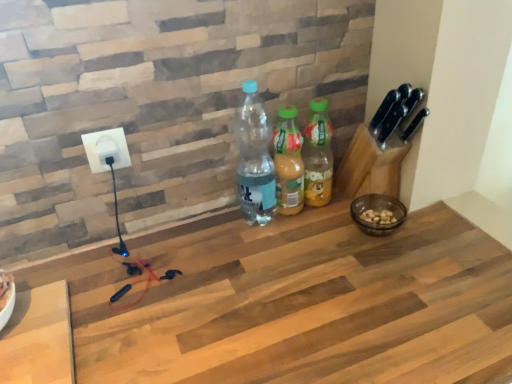
This screenshot has width=512, height=384. Describe the element at coordinates (297, 303) in the screenshot. I see `wooden at center` at that location.

In order to click on transparent plastic bottle at center, which is the first bottle in left-to-right order in this screenshot , I will do `click(254, 158)`.

Choose the correct answer: Is translucent plastic bottle at center, which is counted as the second bottle, starting from the right, inside white plastic socket at upper left or outside it?

The correct answer is: outside.

Is translucent plastic bottle at center, the 2th bottle from the left, directly adjacent to white plastic socket at upper left?

No, translucent plastic bottle at center, the 2th bottle from the left, is not making contact with white plastic socket at upper left.

Based on their sizes in the image, would you say translucent plastic bottle at center, which is counted as the second bottle, starting from the right, is bigger or smaller than white plastic socket at upper left?

In the image, translucent plastic bottle at center, which is counted as the second bottle, starting from the right, appears to be larger than white plastic socket at upper left.

From a real-world perspective, which object stands above the other?

In real-world perspective, white plastic socket at upper left is above.

Can you confirm if transparent plastic bottle at center, which is the first bottle in left-to-right order, is smaller than wooden at center?

Indeed, transparent plastic bottle at center, which is the first bottle in left-to-right order, has a smaller size compared to wooden at center.

Consider the image. Is transparent plastic bottle at center, the third bottle from the right, oriented towards wooden at center?

No, transparent plastic bottle at center, the third bottle from the right, is not turned towards wooden at center.

Is transparent plastic bottle at center, which is the first bottle in left-to-right order, to the right of wooden at center from the viewer's perspective?

In fact, transparent plastic bottle at center, which is the first bottle in left-to-right order, is to the left of wooden at center.

What's the angular difference between translucent plastic bottle at center, arranged as the first bottle when viewed from the right, and transparent plastic bottle at center, the third bottle from the right,'s facing directions?

0.00177 degrees separate the facing orientations of translucent plastic bottle at center, arranged as the first bottle when viewed from the right, and transparent plastic bottle at center, the third bottle from the right.

What are the coordinates of `bottle that is the 2nd object to the left of the translucent plastic bottle at center, which is the third bottle from left to right, starting at the anchor` in the screenshot? It's located at pos(254,158).

Between translucent plastic bottle at center, arranged as the first bottle when viewed from the right, and transparent plastic bottle at center, the third bottle from the right, which one has smaller size?

Smaller between the two is translucent plastic bottle at center, arranged as the first bottle when viewed from the right.

Is translucent plastic bottle at center, which is the third bottle from left to right, facing away from transparent plastic bottle at center, the third bottle from the right?

No, translucent plastic bottle at center, which is the third bottle from left to right, is not facing the opposite direction of transparent plastic bottle at center, the third bottle from the right.

Which of these two, white plastic socket at upper left or translucent plastic bottle at center, arranged as the first bottle when viewed from the right, is thinner?

white plastic socket at upper left is thinner.

Locate an element on the screen. Image resolution: width=512 pixels, height=384 pixels. the 3rd bottle to the right when counting from the white plastic socket at upper left is located at coordinates (318, 155).

Which is more to the right, white plastic socket at upper left or translucent plastic bottle at center, arranged as the first bottle when viewed from the right?

translucent plastic bottle at center, arranged as the first bottle when viewed from the right, is more to the right.

From the image's perspective, is white plastic socket at upper left positioned above or below translucent plastic bottle at center, which is the third bottle from left to right?

From the image's perspective, white plastic socket at upper left appears below translucent plastic bottle at center, which is the third bottle from left to right.

Who is bigger, translucent plastic bottle at center, arranged as the first bottle when viewed from the right, or wooden at center?

With larger size is wooden at center.

Looking at this image, which object is thinner, translucent plastic bottle at center, which is the third bottle from left to right, or wooden at center?

translucent plastic bottle at center, which is the third bottle from left to right.

Consider the image. From a real-world perspective, is translucent plastic bottle at center, which is the third bottle from left to right, physically located above or below wooden at center?

translucent plastic bottle at center, which is the third bottle from left to right, is situated higher than wooden at center in the real world.

Would you consider translucent plastic bottle at center, which is the third bottle from left to right, to be distant from wooden at center?

Actually, translucent plastic bottle at center, which is the third bottle from left to right, and wooden at center are a little close together.

Is wooden at center turned away from white plastic socket at upper left?

No, wooden at center's orientation is not away from white plastic socket at upper left.

Is wooden at center positioned beyond the bounds of white plastic socket at upper left?

wooden at center lies outside white plastic socket at upper left's area.

Which object is closer to the camera taking this photo, wooden at center or white plastic socket at upper left?

wooden at center.

From a real-world perspective, is wooden at center under white plastic socket at upper left?

Yes, from a real-world perspective, wooden at center is beneath white plastic socket at upper left.

Would you consider translucent plastic bottle at center, which is counted as the second bottle, starting from the right, to be distant from translucent plastic bottle at center, which is the third bottle from left to right?

They are positioned close to each other.

Considering the relative sizes of translucent plastic bottle at center, the 2th bottle from the left, and translucent plastic bottle at center, arranged as the first bottle when viewed from the right, in the image provided, is translucent plastic bottle at center, the 2th bottle from the left, shorter than translucent plastic bottle at center, arranged as the first bottle when viewed from the right,?

Yes, translucent plastic bottle at center, the 2th bottle from the left, is shorter than translucent plastic bottle at center, arranged as the first bottle when viewed from the right.

From a real-world perspective, which object stands above the other?

translucent plastic bottle at center, arranged as the first bottle when viewed from the right, is physically above.

Which is more to the right, translucent plastic bottle at center, which is counted as the second bottle, starting from the right, or translucent plastic bottle at center, which is the third bottle from left to right?

translucent plastic bottle at center, which is the third bottle from left to right, is more to the right.

Find the location of a particular element. This screenshot has height=384, width=512. power plugs and sockets on the left of translucent plastic bottle at center, which is counted as the second bottle, starting from the right is located at coordinates pyautogui.click(x=106, y=150).

Find the location of a particular element. The image size is (512, 384). the 1st bottle behind the wooden at center, starting your count from the anchor is located at coordinates (254, 158).

When comparing their distances from translucent plastic bottle at center, which is the third bottle from left to right, does transparent plastic bottle at center, which is the first bottle in left-to-right order, or wooden at center seem further?

wooden at center lies further to translucent plastic bottle at center, which is the third bottle from left to right, than the other object.

Estimate the real-world distances between objects in this image. Which object is closer to white plastic socket at upper left, translucent plastic bottle at center, which is counted as the second bottle, starting from the right, or transparent plastic bottle at center, the third bottle from the right?

transparent plastic bottle at center, the third bottle from the right.

Considering their positions, is wooden at center positioned further to transparent plastic bottle at center, the third bottle from the right, than translucent plastic bottle at center, which is counted as the second bottle, starting from the right?

wooden at center is further to transparent plastic bottle at center, the third bottle from the right.

Based on their spatial positions, is transparent plastic bottle at center, the third bottle from the right, or translucent plastic bottle at center, arranged as the first bottle when viewed from the right, further from wooden at center?

translucent plastic bottle at center, arranged as the first bottle when viewed from the right, is positioned further to the anchor wooden at center.

Looking at this image, which object lies nearer to the anchor point white plastic socket at upper left, translucent plastic bottle at center, arranged as the first bottle when viewed from the right, or translucent plastic bottle at center, the 2th bottle from the left?

translucent plastic bottle at center, the 2th bottle from the left, is positioned closer to the anchor white plastic socket at upper left.

Which object lies further to the anchor point translucent plastic bottle at center, the 2th bottle from the left, white plastic socket at upper left or translucent plastic bottle at center, which is the third bottle from left to right?

Among the two, white plastic socket at upper left is located further to translucent plastic bottle at center, the 2th bottle from the left.

Estimate the real-world distances between objects in this image. Which object is further from white plastic socket at upper left, wooden at center or translucent plastic bottle at center, arranged as the first bottle when viewed from the right?

Among the two, wooden at center is located further to white plastic socket at upper left.

From the image, which object appears to be nearer to translucent plastic bottle at center, which is counted as the second bottle, starting from the right, translucent plastic bottle at center, arranged as the first bottle when viewed from the right, or wooden at center?

translucent plastic bottle at center, arranged as the first bottle when viewed from the right, lies closer to translucent plastic bottle at center, which is counted as the second bottle, starting from the right, than the other object.

At what (x,y) coordinates should I click in order to perform the action: click on power plugs and sockets that lies between translucent plastic bottle at center, arranged as the first bottle when viewed from the right, and wooden at center from top to bottom. Please return your answer as a coordinate pair (x, y). Looking at the image, I should click on (106, 150).

Locate an element on the screen. bottle between translucent plastic bottle at center, which is counted as the second bottle, starting from the right, and wooden at center, in the vertical direction is located at coordinates (254, 158).

This screenshot has width=512, height=384. In order to click on bottle situated between white plastic socket at upper left and translucent plastic bottle at center, which is counted as the second bottle, starting from the right, from left to right in this screenshot , I will do `click(254, 158)`.

This screenshot has width=512, height=384. I want to click on bottle between transparent plastic bottle at center, which is the first bottle in left-to-right order, and translucent plastic bottle at center, which is the third bottle from left to right, so tap(288, 163).